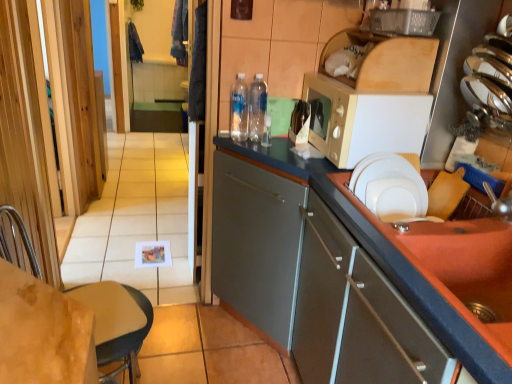
Question: Which is correct: matte gray cabinet at right, which is counted as the second cabinetry, starting from the front, is inside transparent wooden screen door at left, or outside of it?

Choices:
 (A) inside
 (B) outside

Answer: (B)

Question: From the image's perspective, is matte gray cabinet at right, which is counted as the second cabinetry, starting from the front, positioned above or below transparent wooden screen door at left?

Choices:
 (A) above
 (B) below

Answer: (B)

Question: Estimate the real-world distances between objects in this image. Which object is farther from the white matte microwave at upper right?

Choices:
 (A) translucent glass bottle at center, which is the 3th bottle in left-to-right order
 (B) light brown leather chair at lower left
 (C) matte gray cabinet at right, which is counted as the second cabinetry, starting from the front
 (D) clear plastic water bottles at center, the 1th bottle in the left-to-right sequence
 (E) blue fabric laundry at upper left, the 2th laundry when ordered from back to front

Answer: (E)

Question: Which is farther from the dark blue fabric at upper left, arranged as the 1th laundry when viewed from the back?

Choices:
 (A) matte gray cabinet at right, which is the 1th cabinetry in front-to-back order
 (B) clear plastic water bottles at center, the third bottle when ordered from right to left
 (C) light brown leather chair at lower left
 (D) transparent wooden screen door at left
 (E) white matte microwave at upper right

Answer: (A)